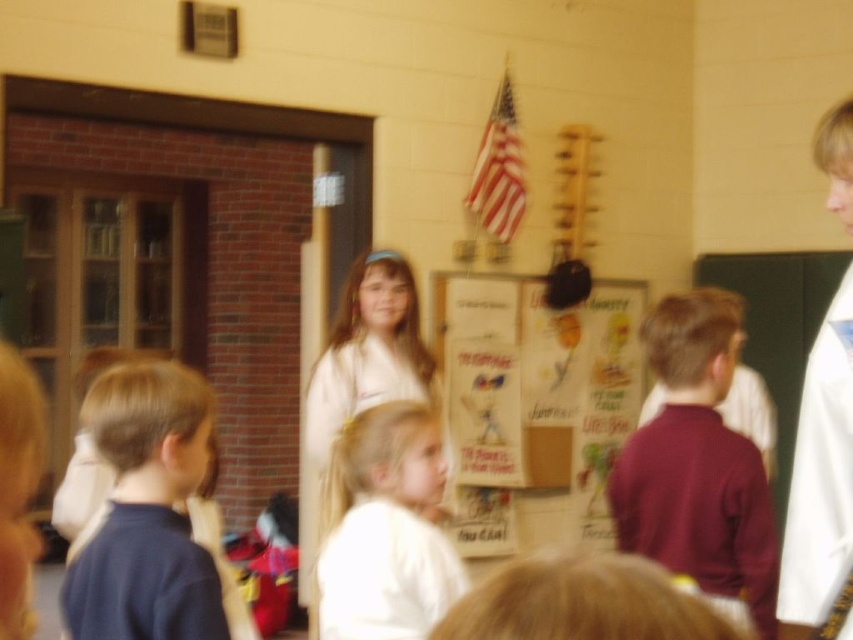
You are a photographer who wants to take a clearer photo of the two main subjects in the classroom scene. The subjects are the maroon sweater at center and the white fabric dress at center. Since the image is currently blurry, you decide to adjust your camera settings to focus on one of them. Which subject should you focus on to ensure the other remains in the background? Explain your reasoning based on their positions.

The maroon sweater at center is to the right of the white fabric dress at center. To ensure the other remains in the background, you should focus on the white fabric dress at center because it is closer to the camera, and focusing on it would place the maroon sweater at center in the background. Alternatively, focusing on the maroon sweater at center would put the white fabric dress at center in the background.

You are a photographer trying to capture a clear shot of the classroom. You notice the dark blue shirt at lower left and the white cotton dress at center. Which object should you focus on to ensure it appears more prominent in the photo?

The white cotton dress at center occupies more space in the image than the dark blue shirt at lower left, so focusing on the white cotton dress at center would make it appear more prominent in the photo.

You are a photographer who needs to adjust the lighting in the classroom. The cardboard poster at center and the white fabric dress at center are both in the frame. Which object should you focus on to ensure proper exposure, considering one is much taller than the other?

The cardboard poster at center is much taller than the white fabric dress at center, so you should focus on the cardboard poster at center to ensure proper exposure since it occupies more of the frame.